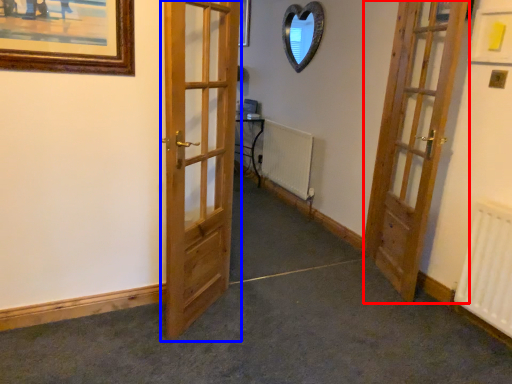
Question: Which object is closer to the camera taking this photo, door (highlighted by a red box) or door (highlighted by a blue box)?

Choices:
 (A) door
 (B) door

Answer: (B)